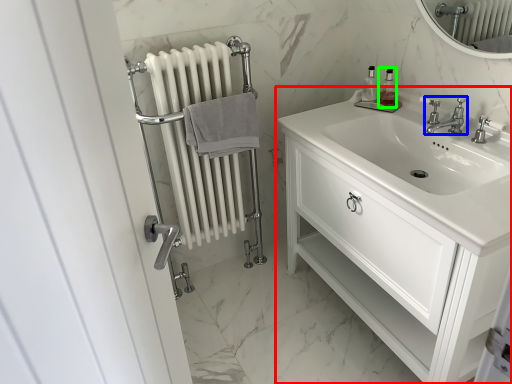
Question: Which is nearer to the bathroom cabinet (highlighted by a red box)? tap (highlighted by a blue box) or soap dispenser (highlighted by a green box).

Choices:
 (A) tap
 (B) soap dispenser

Answer: (A)